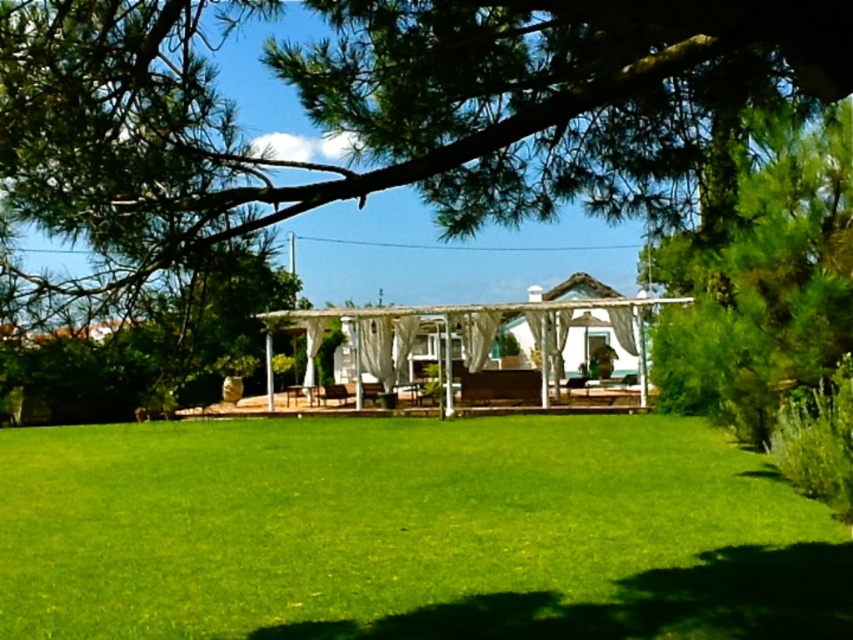
Does point (679, 140) lie in front of point (553, 371)?

Yes.

Which is more to the left, green leafy tree at upper center or white fabric gazebo at center?

Positioned to the left is green leafy tree at upper center.

Based on the photo, who is more distant from viewer, (730, 35) or (373, 349)?

The point (373, 349) is behind.

Find the location of `green leafy tree at upper center`. green leafy tree at upper center is located at coordinates (381, 112).

Based on the photo, which is more to the left, green leafy tree at upper right or white fabric gazebo at center?

From the viewer's perspective, white fabric gazebo at center appears more on the left side.

Is green leafy tree at upper right closer to camera compared to white fabric gazebo at center?

No, green leafy tree at upper right is further to the viewer.

Identify the location of green leafy tree at upper right. This screenshot has width=853, height=640. (759, 280).

Does point (160, 500) come farther from viewer compared to point (554, 316)?

No.

Which is in front, point (456, 515) or point (647, 308)?

Point (456, 515)

Is point (529, 602) less distant than point (634, 356)?

Yes, it is.

At what (x,y) coordinates should I click in order to perform the action: click on green grass at center. Please return your answer as a coordinate pair (x, y). This screenshot has width=853, height=640. Looking at the image, I should click on (409, 531).